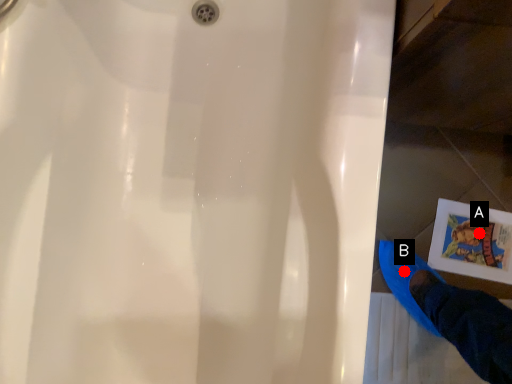
Question: Two points are circled on the image, labeled by A and B beside each circle. Which point appears farthest from the camera in this image?

Choices:
 (A) A is further
 (B) B is further

Answer: (A)